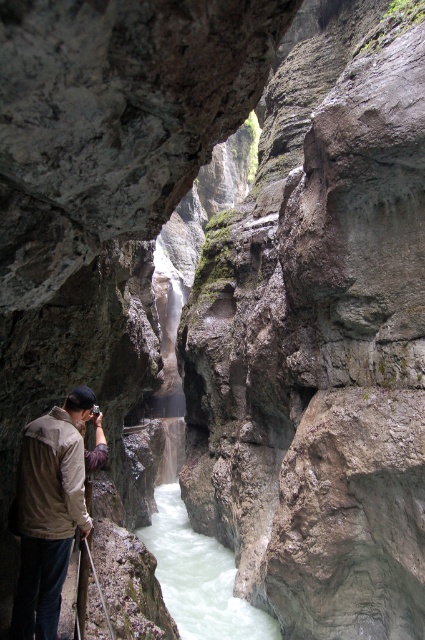
Question: Does tan fabric jacket at lower left have a greater width compared to white frothy water at center?

Choices:
 (A) no
 (B) yes

Answer: (A)

Question: Does tan fabric jacket at lower left lie behind white frothy water at center?

Choices:
 (A) yes
 (B) no

Answer: (B)

Question: Among these points, which one is nearest to the camera?

Choices:
 (A) (229, 608)
 (B) (19, 518)

Answer: (B)

Question: From the image, what is the correct spatial relationship of tan fabric jacket at lower left in relation to white frothy water at center?

Choices:
 (A) left
 (B) right

Answer: (A)